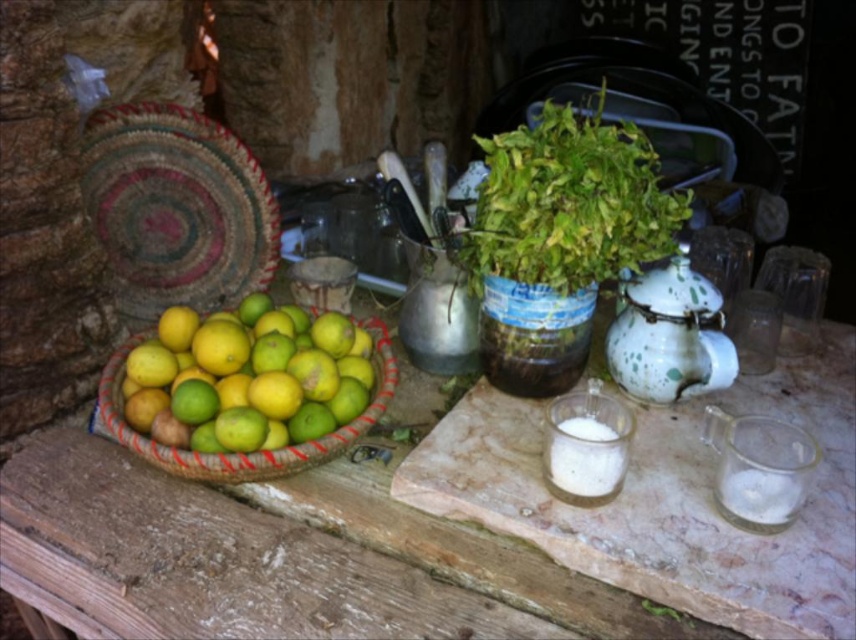
Between point (617, 268) and point (629, 330), which one is positioned behind?

Positioned behind is point (629, 330).

Measure the distance between green leafy plant at upper center and camera.

They are 36.43 inches apart.

Where is `green leafy plant at upper center`? This screenshot has width=856, height=640. green leafy plant at upper center is located at coordinates click(569, 202).

Is green leafy plant at upper center below bright yellow-green woven basket at left?

Incorrect, green leafy plant at upper center is not positioned below bright yellow-green woven basket at left.

Find the location of a particular element. The width and height of the screenshot is (856, 640). green leafy plant at upper center is located at coordinates [x=569, y=202].

In the scene shown: Can you confirm if speckled ceramic teapot at center-right is taller than bright yellow-green woven basket at left?

Incorrect, speckled ceramic teapot at center-right's height is not larger of bright yellow-green woven basket at left's.

Can you confirm if speckled ceramic teapot at center-right is bigger than bright yellow-green woven basket at left?

No.

Does point (676, 285) come closer to viewer compared to point (345, 435)?

No, it is not.

Identify the location of speckled ceramic teapot at center-right. coord(669,333).